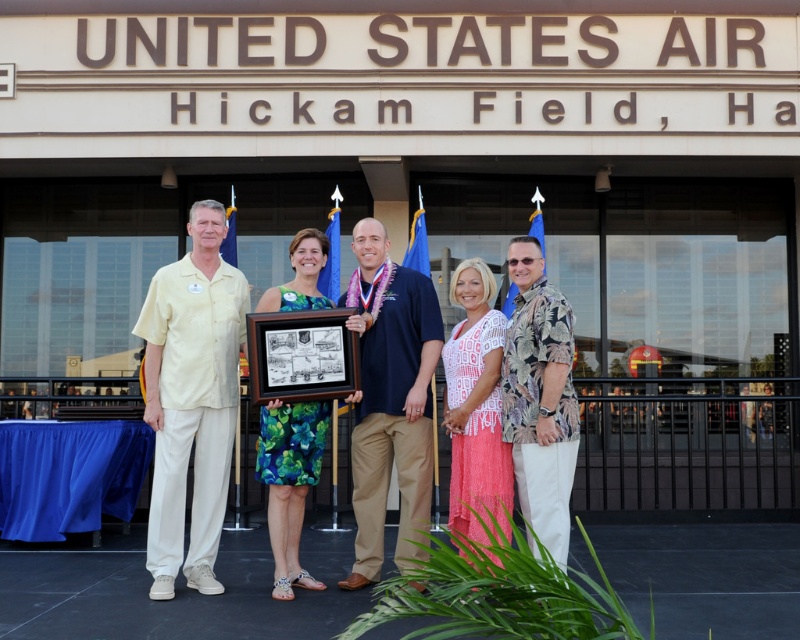
Question: Which of the following is the farthest from the observer?

Choices:
 (A) (186, 268)
 (B) (358, 392)
 (C) (516, 358)

Answer: (A)

Question: Is yellow cotton shirt at left further to camera compared to dark blue shirt at center?

Choices:
 (A) yes
 (B) no

Answer: (A)

Question: Does dark blue shirt at center have a greater width compared to hawaiian print shirt at center?

Choices:
 (A) yes
 (B) no

Answer: (A)

Question: Which object appears farthest from the camera in this image?

Choices:
 (A) dark blue shirt at center
 (B) yellow cotton shirt at left

Answer: (B)

Question: Is yellow cotton shirt at left positioned at the back of hawaiian print shirt at center?

Choices:
 (A) no
 (B) yes

Answer: (B)

Question: Based on their relative distances, which object is farther from the yellow cotton shirt at left?

Choices:
 (A) hawaiian print shirt at center
 (B) dark blue shirt at center

Answer: (A)